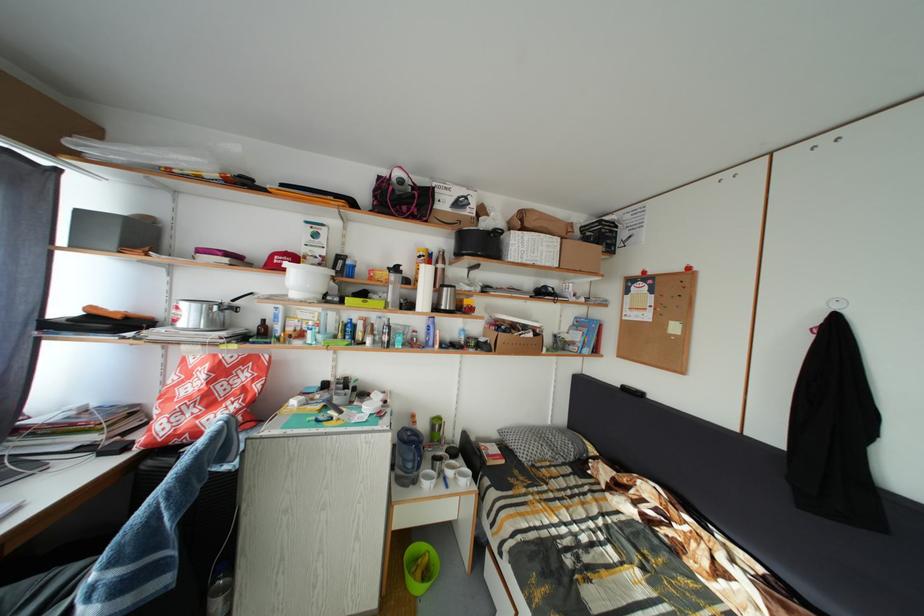
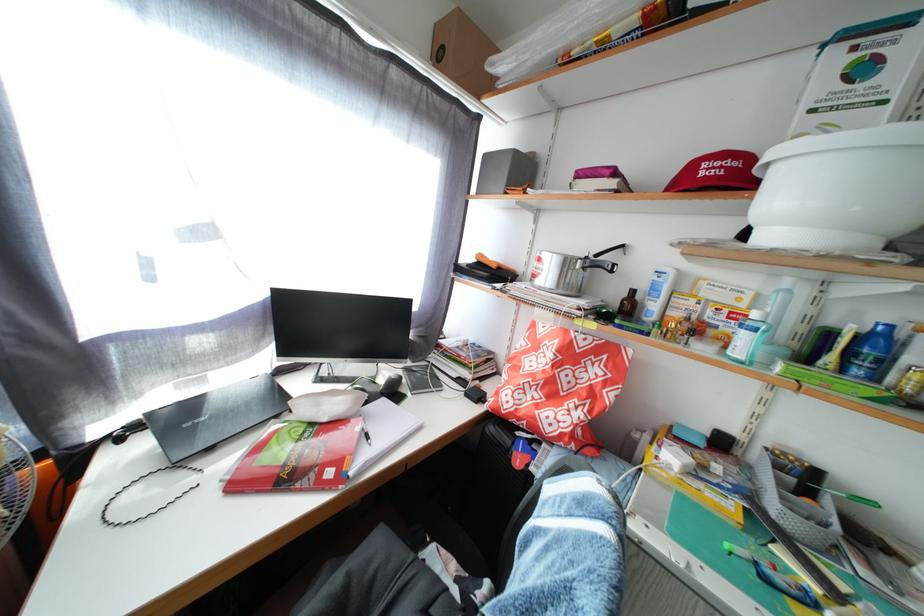
Where in the second image is the point corresponding to point (357, 344) from the first image?

(866, 378)